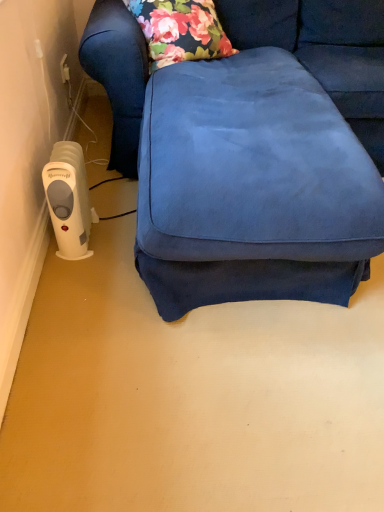
Question: In terms of size, does suede blue couch at center appear bigger or smaller than white plastic heater at lower left?

Choices:
 (A) big
 (B) small

Answer: (A)

Question: In the image, is suede blue couch at center on the left side or the right side of white plastic heater at lower left?

Choices:
 (A) right
 (B) left

Answer: (A)

Question: Is suede blue couch at center inside the boundaries of white plastic heater at lower left, or outside?

Choices:
 (A) inside
 (B) outside

Answer: (B)

Question: Visually, is white plastic heater at lower left positioned to the left or to the right of suede blue couch at center?

Choices:
 (A) left
 (B) right

Answer: (A)

Question: Looking at the image, does white plastic heater at lower left seem bigger or smaller compared to suede blue couch at center?

Choices:
 (A) small
 (B) big

Answer: (A)

Question: From the image's perspective, is white plastic heater at lower left positioned above or below suede blue couch at center?

Choices:
 (A) below
 (B) above

Answer: (A)

Question: From a real-world perspective, relative to suede blue couch at center, is white plastic heater at lower left vertically above or below?

Choices:
 (A) above
 (B) below

Answer: (B)